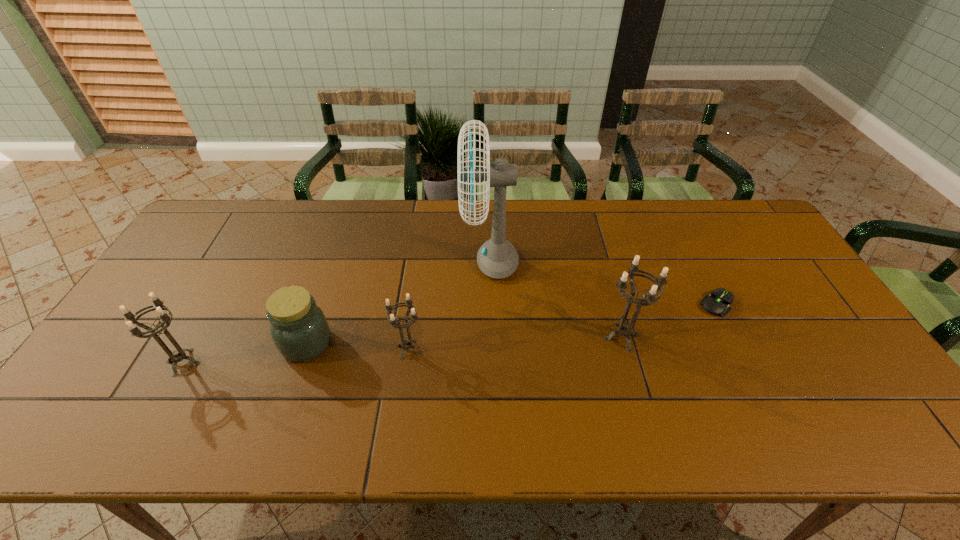
You are a GUI agent. You are given a task and a screenshot of the screen. Output one action in this format:
    pyautogui.click(x=<x>, y=<y>)
    Task: Click on the leftmost object
    The height and width of the screenshot is (540, 960).
    Given the screenshot: What is the action you would take?
    pyautogui.click(x=178, y=355)

What are the coordinates of `the leftmost candle holder` in the screenshot? It's located at (178, 355).

Image resolution: width=960 pixels, height=540 pixels. Identify the location of the second candle holder from right to left. (406, 343).

The image size is (960, 540). Identify the location of the shortest candle holder. (406, 343).

You are a GUI agent. You are given a task and a screenshot of the screen. Output one action in this format:
    pyautogui.click(x=<x>, y=<y>)
    Task: Click on the second object from right to left
    
    Given the screenshot: What is the action you would take?
    pyautogui.click(x=625, y=329)

This screenshot has height=540, width=960. I want to click on fan, so click(497, 258).

Locate an element on the screen. The image size is (960, 540). the third object from right to left is located at coordinates (497, 258).

Identify the location of jar. This screenshot has height=540, width=960. (299, 329).

Where is `the rightmost object`? The width and height of the screenshot is (960, 540). the rightmost object is located at coordinates (717, 303).

Find the location of a particular element. Image resolution: width=960 pixels, height=540 pixels. the shortest object is located at coordinates (717, 303).